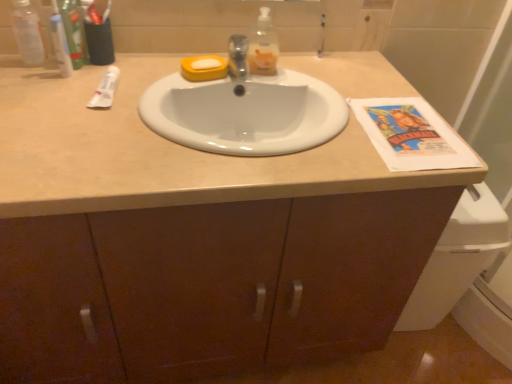
The width and height of the screenshot is (512, 384). I want to click on unoccupied region to the right of white matte tube at upper left, so click(x=153, y=98).